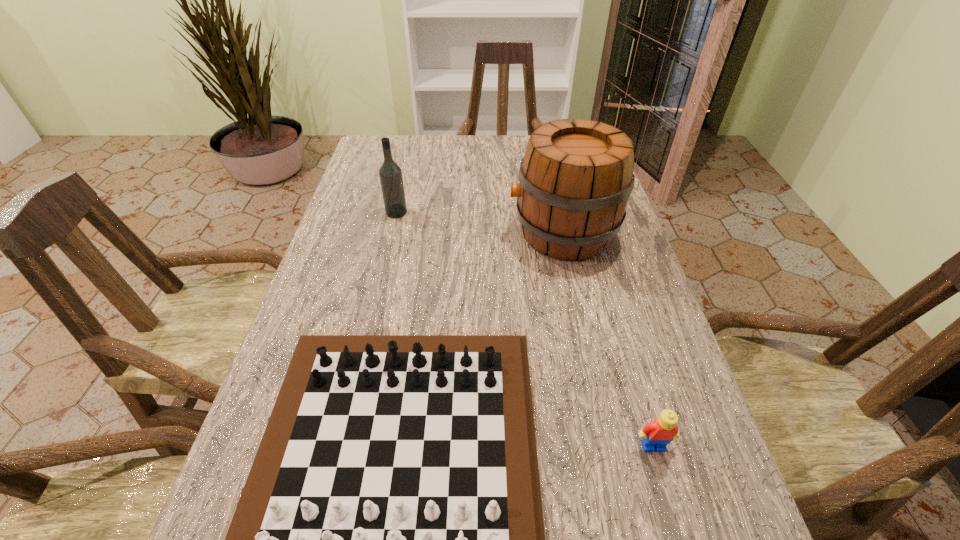
The image size is (960, 540). I want to click on cider, so (575, 179).

Find the location of a particular element. The height and width of the screenshot is (540, 960). the second tallest object is located at coordinates (391, 179).

Locate an element on the screen. Lego is located at coordinates (660, 432).

The image size is (960, 540). In order to click on free space located on the side of the tallest object where the spigot is located in this screenshot , I will do `click(394, 233)`.

What are the coordinates of `vacant space situated 0.270m on the side of the tallest object where the spigot is located` in the screenshot? It's located at (401, 233).

Identify the location of vacant region located on the side of the tallest object where the spigot is located. (409, 233).

The width and height of the screenshot is (960, 540). Identify the location of free space located 0.280m on the back of the vodka. (410, 155).

Where is `free spot located 0.060m on the face of the Lego`? This screenshot has height=540, width=960. free spot located 0.060m on the face of the Lego is located at coordinates (667, 492).

You are a GUI agent. You are given a task and a screenshot of the screen. Output one action in this format:
    pyautogui.click(x=<x>, y=<y>)
    Task: Click on the object present at the left edge
    The image size is (960, 540).
    Given the screenshot: What is the action you would take?
    pyautogui.click(x=391, y=179)

The width and height of the screenshot is (960, 540). I want to click on cider that is at the right edge, so click(575, 179).